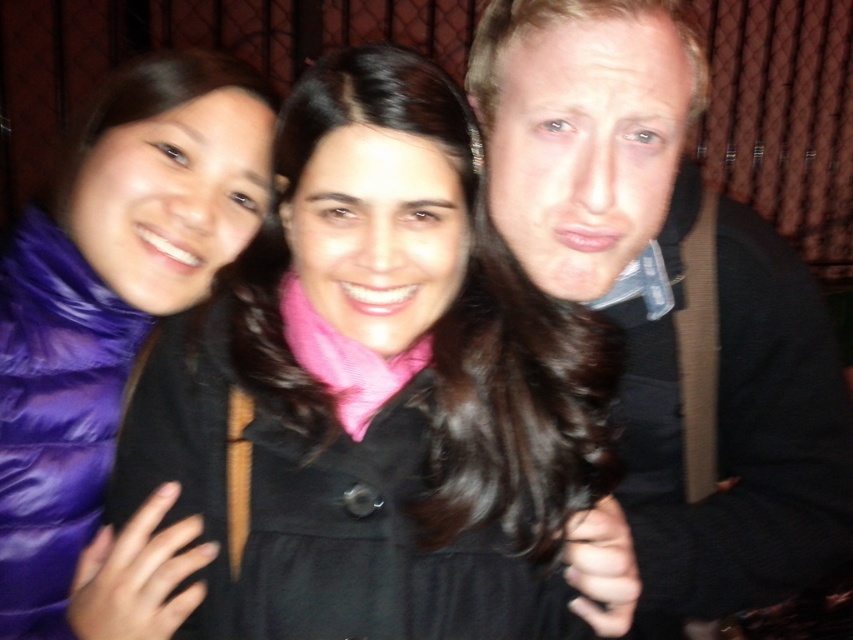
You are a photographer adjusting the lighting for a group photo. You notice a point at coordinates (670, 301) on the image. What object is located at this point?

The point at coordinates (670, 301) is occupied by the smooth black shirt at center.

You are a photographer trying to adjust the framing of this group photo. You need to ensure that the smooth black shirt at center and the purple down jacket at left are both visible in the frame. Considering their sizes, which one might require more space in the composition?

The smooth black shirt at center requires more space in the composition because its width is larger than the purple down jacket at left.

You are a photographer trying to adjust the framing of a group photo. You need to ensure that the matte black coat at center and the purple down jacket at left are both fully visible in the frame. Based on their relative widths, which of the two requires more horizontal space to be fully captured?

The matte black coat at center might require more horizontal space to be fully captured since it is wider than the purple down jacket at left according to the description.